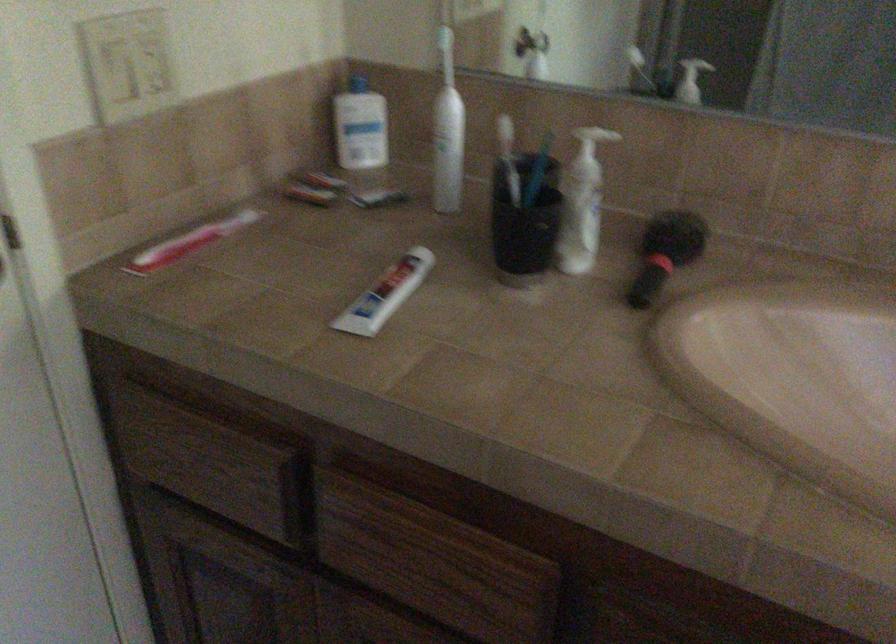
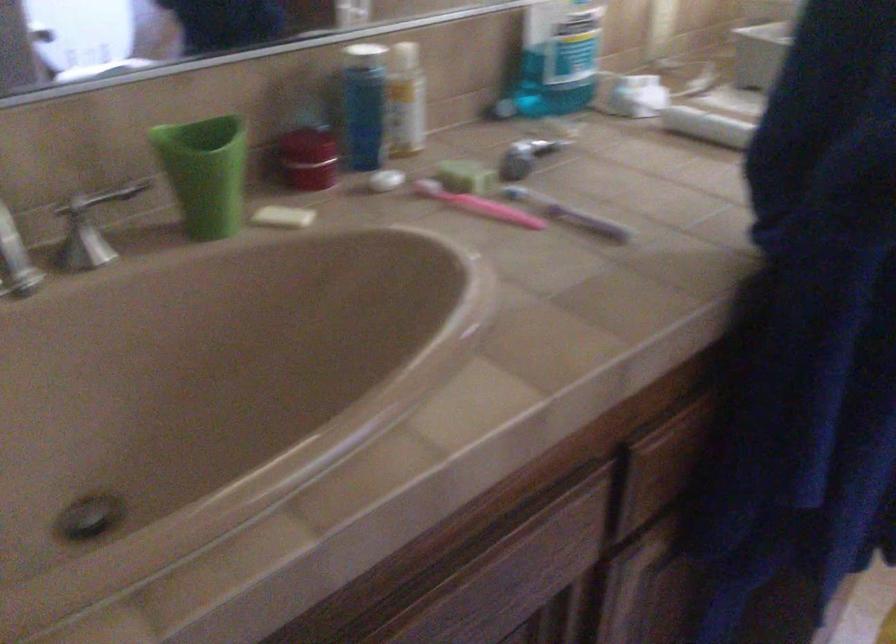
Based on the continuous images, in which direction is the camera rotating?

The camera rotated toward right-down.